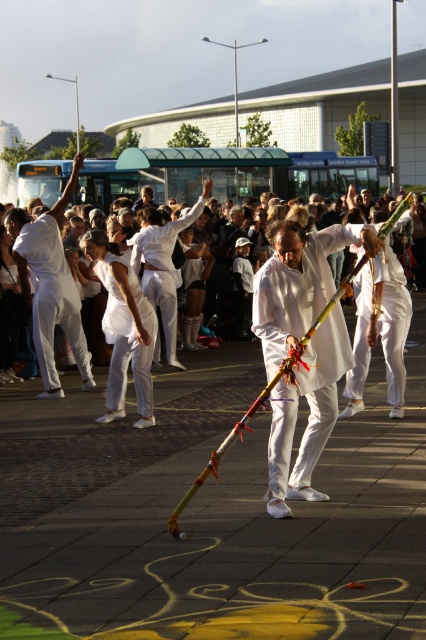
Is white matte robe at center behind white matte/soft robe at center?

No.

This screenshot has width=426, height=640. What do you see at coordinates (380, 326) in the screenshot?
I see `white matte robe at center` at bounding box center [380, 326].

This screenshot has width=426, height=640. In order to click on white matte robe at center in this screenshot , I will do `click(380, 326)`.

Does white matte/soft fabric man at left have a greater width compared to white clothed people at center?

Correct, the width of white matte/soft fabric man at left exceeds that of white clothed people at center.

Identify the location of white matte/soft fabric man at left. (49, 285).

Is white matte robe at center smaller than white clothed people at center?

Actually, white matte robe at center might be larger than white clothed people at center.

Between point (400, 390) and point (97, 248), which one is positioned in front?

Point (97, 248) is in front.

Where is `white matte robe at center`? Image resolution: width=426 pixels, height=640 pixels. white matte robe at center is located at coordinates (380, 326).